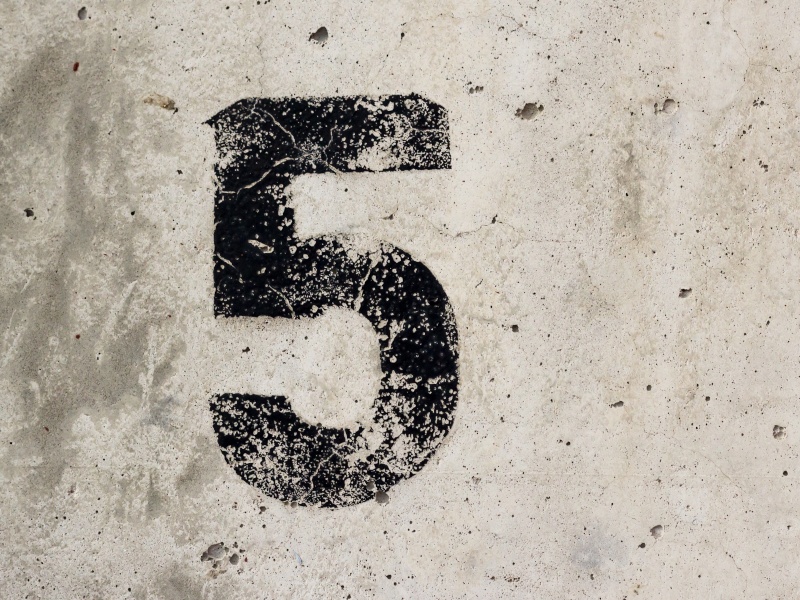
The width and height of the screenshot is (800, 600). I want to click on greyish part of wall, so click(x=106, y=104).